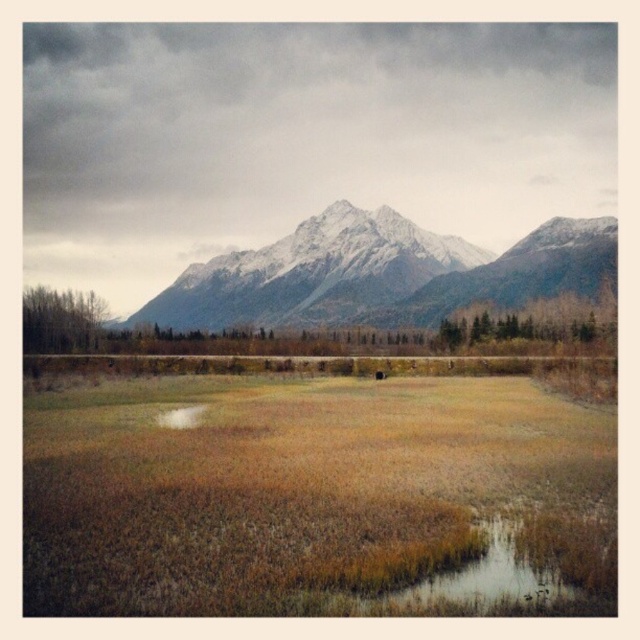
Identify the location of brown dry grass at center. This screenshot has height=640, width=640. tap(312, 496).

Does brown dry grass at center lie in front of snowy granite mountain range at upper center?

Yes, it is in front of snowy granite mountain range at upper center.

Between point (240, 506) and point (236, 268), which one is positioned behind?

Positioned behind is point (236, 268).

In order to click on brown dry grass at center in this screenshot , I will do click(312, 496).